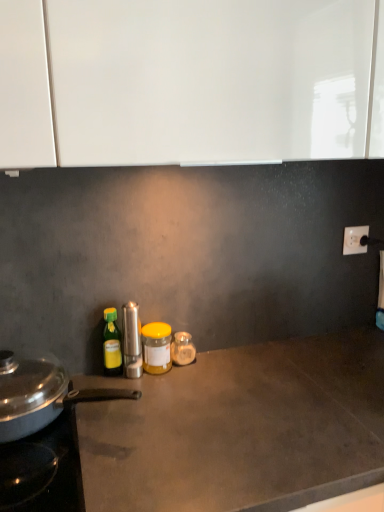
Find the location of `unoccupied region to the right of metallic silver pan at left, which appears as the first kitchen appliance when viewed from the left`. unoccupied region to the right of metallic silver pan at left, which appears as the first kitchen appliance when viewed from the left is located at coordinates (196, 416).